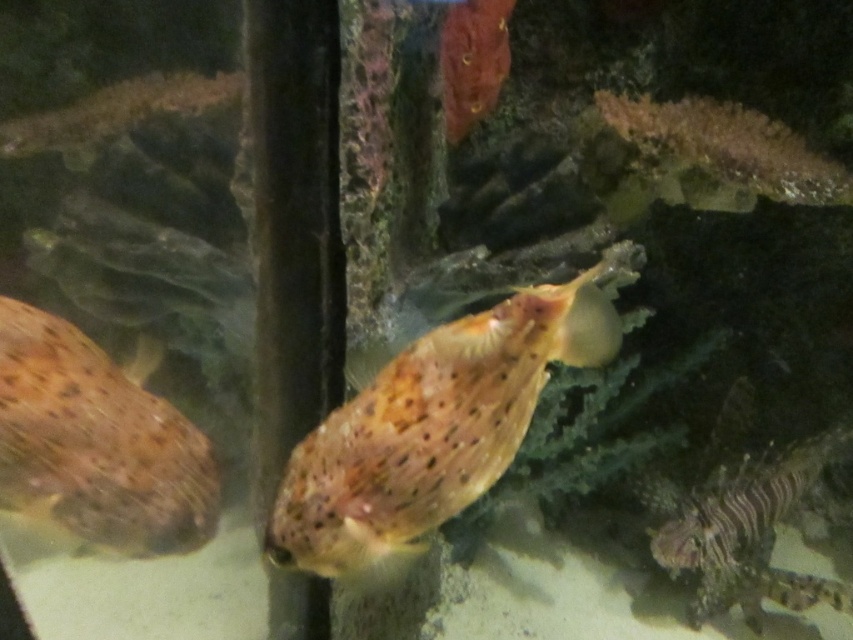
You are a marine biologist observing an underwater scene in an aquarium. You notice a spotted orange fish at center and another fish near the left side. Based on their positions, can you determine which fish is closer to the observation point at coordinates point [434,424]?

The spotted orange fish at center is located at point [434,424], so it is exactly at the observation point. Therefore, it is closer than the other fish near the left side.

You are an underwater photographer aiming to capture both the spotted orange fish at center and the speckled skin at left in a single shot. Based on their positions, can you determine which one is closer to the camera?

The spotted orange fish at center is located above the speckled skin at left, so it is closer to the camera.